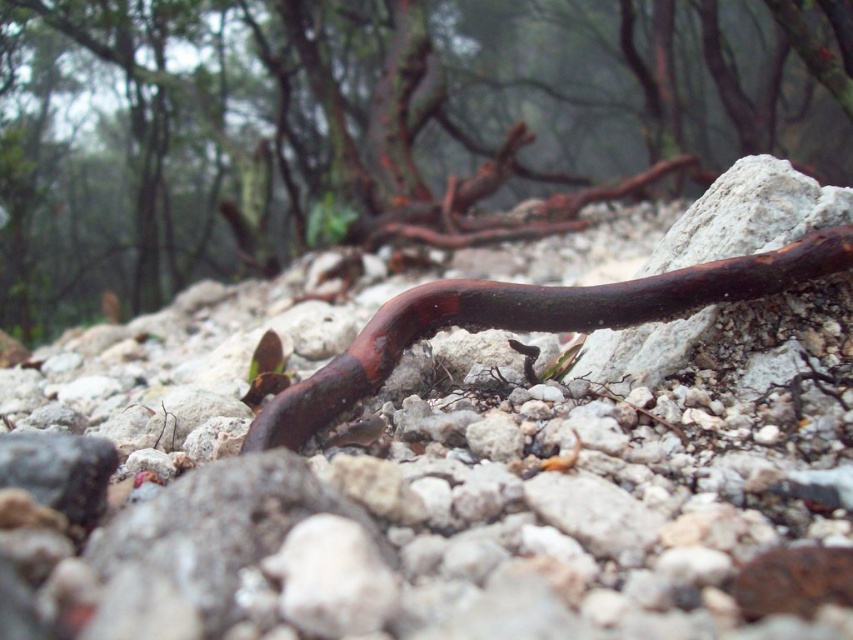
Question: Which point is farther to the camera?

Choices:
 (A) (711, 163)
 (B) (598, 307)

Answer: (A)

Question: Which point is farther to the camera?

Choices:
 (A) rusty metal worm at center
 (B) glossy brown branch at center

Answer: (B)

Question: Which object appears farthest from the camera in this image?

Choices:
 (A) rusty metal worm at center
 (B) glossy brown branch at center

Answer: (B)

Question: Can you confirm if glossy brown branch at center is positioned above rusty metal worm at center?

Choices:
 (A) no
 (B) yes

Answer: (B)

Question: In this image, where is glossy brown branch at center located relative to rusty metal worm at center?

Choices:
 (A) left
 (B) right

Answer: (A)

Question: Is glossy brown branch at center to the left of rusty metal worm at center from the viewer's perspective?

Choices:
 (A) no
 (B) yes

Answer: (B)